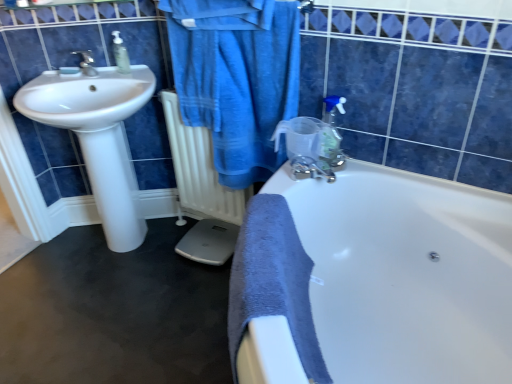
The image size is (512, 384). In order to click on blue cotton bathrobe at upper center in this screenshot , I will do `click(236, 78)`.

Where is `white matte radiator at center`? This screenshot has height=384, width=512. white matte radiator at center is located at coordinates (199, 169).

The width and height of the screenshot is (512, 384). Describe the element at coordinates (120, 54) in the screenshot. I see `clear plastic soap dispenser at upper left, positioned as the first soap dispenser in left-to-right order` at that location.

The width and height of the screenshot is (512, 384). I want to click on clear plastic soap dispenser at upper left, which is counted as the first soap dispenser, starting from the top, so click(120, 54).

Where is `white glossy sink at left`? The image size is (512, 384). white glossy sink at left is located at coordinates (98, 135).

You are a GUI agent. You are given a task and a screenshot of the screen. Output one action in this format:
    pyautogui.click(x=<x>, y=<y>)
    Task: Click on the blue cotton bathrobe at upper center
    This screenshot has width=512, height=384.
    Given the screenshot: What is the action you would take?
    pyautogui.click(x=236, y=78)

Which object is wider, clear plastic soap dispenser at upper left, the second soap dispenser from the right, or blue cotton bathrobe at upper center?

blue cotton bathrobe at upper center.

Is clear plastic soap dispenser at upper left, which is counted as the first soap dispenser, starting from the top, facing away from blue cotton bathrobe at upper center?

No.

From a real-world perspective, is clear plastic soap dispenser at upper left, the 2th soap dispenser positioned from the front, physically located above or below blue cotton bathrobe at upper center?

clear plastic soap dispenser at upper left, the 2th soap dispenser positioned from the front, is above blue cotton bathrobe at upper center.

Looking at this image, which is correct: clear plastic soap dispenser at upper left, the 1th soap dispenser when ordered from back to front, is inside blue cotton bathrobe at upper center, or outside of it?

clear plastic soap dispenser at upper left, the 1th soap dispenser when ordered from back to front, is not inside blue cotton bathrobe at upper center, it's outside.

Is there a large distance between translucent plastic soap dispenser at upper right, the 1th soap dispenser in the right-to-left sequence, and white glossy sink at left?

No, translucent plastic soap dispenser at upper right, the 1th soap dispenser in the right-to-left sequence, is in close proximity to white glossy sink at left.

Measure the distance from translucent plastic soap dispenser at upper right, which appears as the second soap dispenser when viewed from the back, to white glossy sink at left.

translucent plastic soap dispenser at upper right, which appears as the second soap dispenser when viewed from the back, and white glossy sink at left are 93.90 centimeters apart from each other.

Considering the positions of objects translucent plastic soap dispenser at upper right, which is the 2th soap dispenser from left to right, and white glossy sink at left in the image provided, who is more to the left, translucent plastic soap dispenser at upper right, which is the 2th soap dispenser from left to right, or white glossy sink at left?

From the viewer's perspective, white glossy sink at left appears more on the left side.

From the image's perspective, is white glossy sink at left on top of white matte radiator at center?

No, from the image's perspective, white glossy sink at left is not on top of white matte radiator at center.

Considering the relative positions of white glossy sink at left and white matte radiator at center in the image provided, is white glossy sink at left behind white matte radiator at center?

That is False.

Is white glossy sink at left looking in the opposite direction of white matte radiator at center?

No.

Does white glossy sink at left appear on the left side of white matte radiator at center?

Yes, white glossy sink at left is to the left of white matte radiator at center.

Would you say clear plastic soap dispenser at upper left, acting as the 2th soap dispenser starting from the bottom, contains white glossy sink at left?

No, white glossy sink at left is not surrounded by clear plastic soap dispenser at upper left, acting as the 2th soap dispenser starting from the bottom.

Is clear plastic soap dispenser at upper left, which is counted as the first soap dispenser, starting from the top, looking in the opposite direction of white glossy sink at left?

Yes, clear plastic soap dispenser at upper left, which is counted as the first soap dispenser, starting from the top, is facing away from white glossy sink at left.

From the image's perspective, between clear plastic soap dispenser at upper left, acting as the 2th soap dispenser starting from the bottom, and white glossy sink at left, which one is located above?

From the image's view, clear plastic soap dispenser at upper left, acting as the 2th soap dispenser starting from the bottom, is above.

Consider the image. Which is more to the left, translucent plastic soap dispenser at upper right, which appears as the second soap dispenser when viewed from the back, or blue cotton bathrobe at upper center?

blue cotton bathrobe at upper center is more to the left.

Is translucent plastic soap dispenser at upper right, which is the 2th soap dispenser from left to right, turned away from blue cotton bathrobe at upper center?

That's not correct — translucent plastic soap dispenser at upper right, which is the 2th soap dispenser from left to right, is not looking away from blue cotton bathrobe at upper center.

Based on the photo, from the image's perspective, between translucent plastic soap dispenser at upper right, which is the 2th soap dispenser from left to right, and blue cotton bathrobe at upper center, who is located below?

translucent plastic soap dispenser at upper right, which is the 2th soap dispenser from left to right.

Is point (333, 119) more distant than point (263, 146)?

No, (333, 119) is in front of (263, 146).

Looking at this image, from a real-world perspective, relative to white matte radiator at center, is white glossy bathtub at center vertically above or below?

white glossy bathtub at center is below white matte radiator at center.

The width and height of the screenshot is (512, 384). In the image, there is a white matte radiator at center. Identify the location of bathtub below it (from a real-world perspective). (406, 275).

From the image's perspective, who appears lower, white glossy bathtub at center or white matte radiator at center?

white glossy bathtub at center is shown below in the image.

Is white glossy bathtub at center bigger than clear plastic soap dispenser at upper left, the 1th soap dispenser when ordered from back to front?

Indeed, white glossy bathtub at center has a larger size compared to clear plastic soap dispenser at upper left, the 1th soap dispenser when ordered from back to front.

Based on the photo, is white glossy bathtub at center situated inside clear plastic soap dispenser at upper left, the 1th soap dispenser when ordered from back to front, or outside?

white glossy bathtub at center is not enclosed by clear plastic soap dispenser at upper left, the 1th soap dispenser when ordered from back to front.

Is white glossy bathtub at center oriented away from clear plastic soap dispenser at upper left, acting as the 2th soap dispenser starting from the bottom?

No, white glossy bathtub at center's orientation is not away from clear plastic soap dispenser at upper left, acting as the 2th soap dispenser starting from the bottom.

Would you say white glossy bathtub at center is a long distance from clear plastic soap dispenser at upper left, the second soap dispenser from the right?

Absolutely, white glossy bathtub at center is distant from clear plastic soap dispenser at upper left, the second soap dispenser from the right.

Image resolution: width=512 pixels, height=384 pixels. In order to click on bathrobe below the clear plastic soap dispenser at upper left, acting as the 2th soap dispenser starting from the bottom (from the image's perspective) in this screenshot , I will do `click(236, 78)`.

The width and height of the screenshot is (512, 384). I want to click on sink on the left of translucent plastic soap dispenser at upper right, the 1th soap dispenser in the right-to-left sequence, so click(98, 135).

Looking at the image, which one is located closer to blue cotton bathrobe at upper center, translucent plastic soap dispenser at upper right, which appears as the second soap dispenser when viewed from the back, or white matte radiator at center?

Among the two, white matte radiator at center is located nearer to blue cotton bathrobe at upper center.

Based on their spatial positions, is translucent plastic soap dispenser at upper right, the 1th soap dispenser from the front, or white glossy sink at left closer to clear plastic soap dispenser at upper left, acting as the 2th soap dispenser starting from the bottom?

Based on the image, white glossy sink at left appears to be nearer to clear plastic soap dispenser at upper left, acting as the 2th soap dispenser starting from the bottom.

Considering their positions, is white glossy bathtub at center positioned further to blue cotton bathrobe at upper center than white matte radiator at center?

Based on the image, white glossy bathtub at center appears to be further to blue cotton bathrobe at upper center.

Considering their positions, is white glossy sink at left positioned closer to translucent plastic soap dispenser at upper right, which appears as the second soap dispenser when viewed from the back, than white glossy bathtub at center?

Based on the image, white glossy bathtub at center appears to be nearer to translucent plastic soap dispenser at upper right, which appears as the second soap dispenser when viewed from the back.

Which object lies nearer to the anchor point blue cotton bathrobe at upper center, white matte radiator at center or translucent plastic soap dispenser at upper right, the first soap dispenser positioned from the bottom?

white matte radiator at center.

In the scene shown: From the image, which object appears to be farther from translucent plastic soap dispenser at upper right, the first soap dispenser positioned from the bottom, blue cotton bathrobe at upper center or white matte radiator at center?

white matte radiator at center is positioned further to the anchor translucent plastic soap dispenser at upper right, the first soap dispenser positioned from the bottom.

When comparing their distances from white matte radiator at center, does translucent plastic soap dispenser at upper right, which is the 2th soap dispenser from left to right, or blue cotton bathrobe at upper center seem closer?

Based on the image, blue cotton bathrobe at upper center appears to be nearer to white matte radiator at center.

Estimate the real-world distances between objects in this image. Which object is closer to translucent plastic soap dispenser at upper right, the first soap dispenser positioned from the bottom, clear plastic soap dispenser at upper left, the 2th soap dispenser positioned from the front, or white glossy bathtub at center?

The object closer to translucent plastic soap dispenser at upper right, the first soap dispenser positioned from the bottom, is white glossy bathtub at center.

Where is `radiator situated between clear plastic soap dispenser at upper left, which is counted as the first soap dispenser, starting from the top, and blue cotton bathrobe at upper center from left to right`? This screenshot has width=512, height=384. radiator situated between clear plastic soap dispenser at upper left, which is counted as the first soap dispenser, starting from the top, and blue cotton bathrobe at upper center from left to right is located at coordinates (199, 169).

Identify the location of radiator that lies between clear plastic soap dispenser at upper left, acting as the 2th soap dispenser starting from the bottom, and white glossy sink at left from top to bottom. This screenshot has width=512, height=384. (199, 169).

In order to click on bathrobe between white glossy bathtub at center and clear plastic soap dispenser at upper left, which is counted as the first soap dispenser, starting from the top, along the z-axis in this screenshot , I will do `click(236, 78)`.

The width and height of the screenshot is (512, 384). What are the coordinates of `soap dispenser between white glossy bathtub at center and clear plastic soap dispenser at upper left, the second soap dispenser from the right, along the z-axis` in the screenshot? It's located at (332, 132).